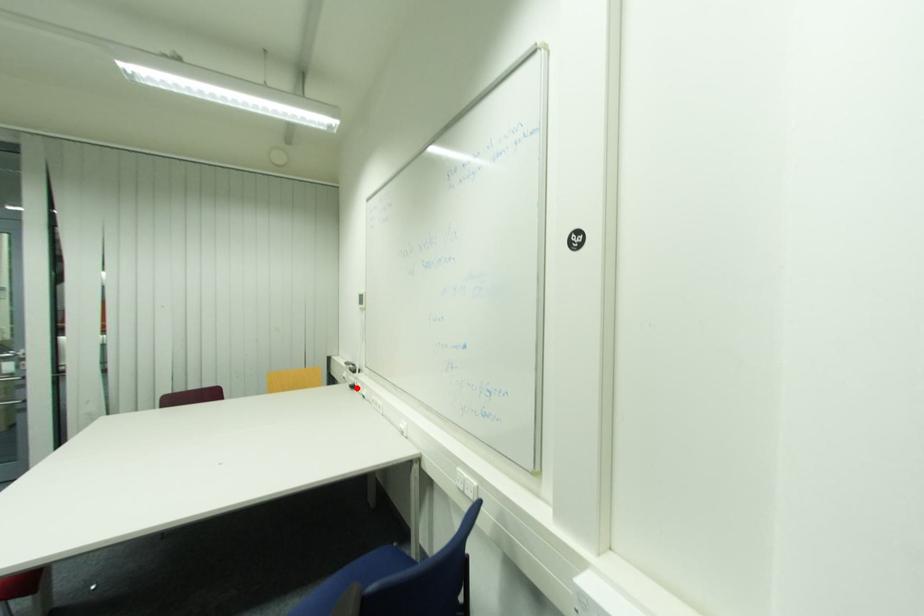
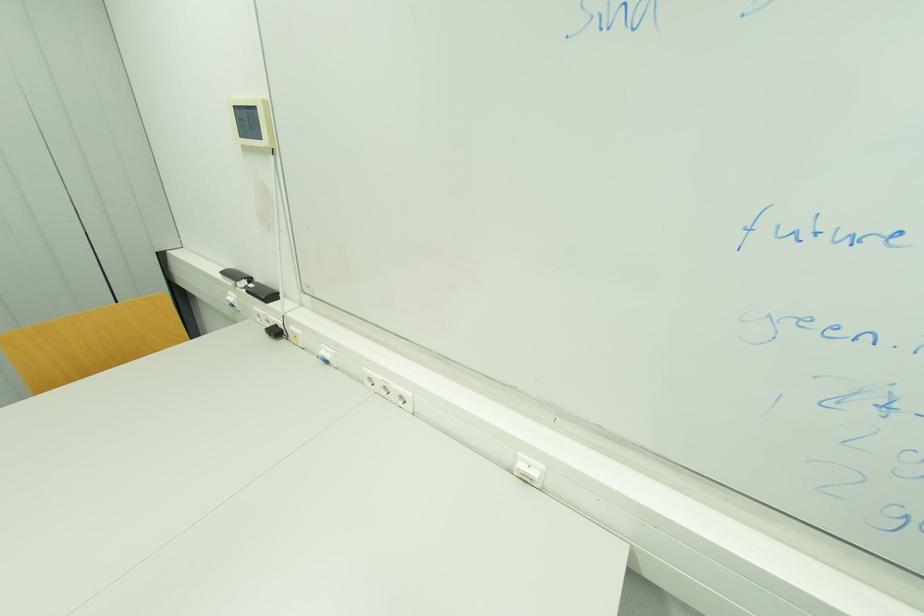
The point at the highlighted location is marked in the first image. Where is the corresponding point in the second image?

(281, 333)